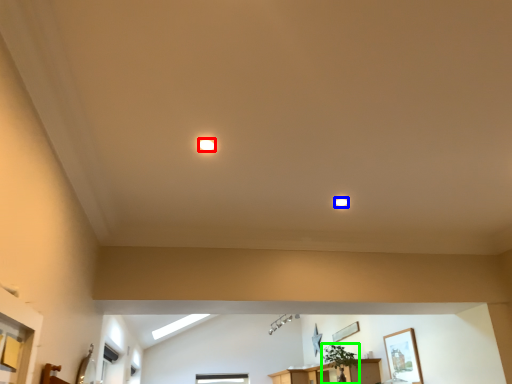
Question: Considering the real-world distances, which object is closest to lighting (highlighted by a red box)? lighting (highlighted by a blue box) or plant (highlighted by a green box).

Choices:
 (A) lighting
 (B) plant

Answer: (A)